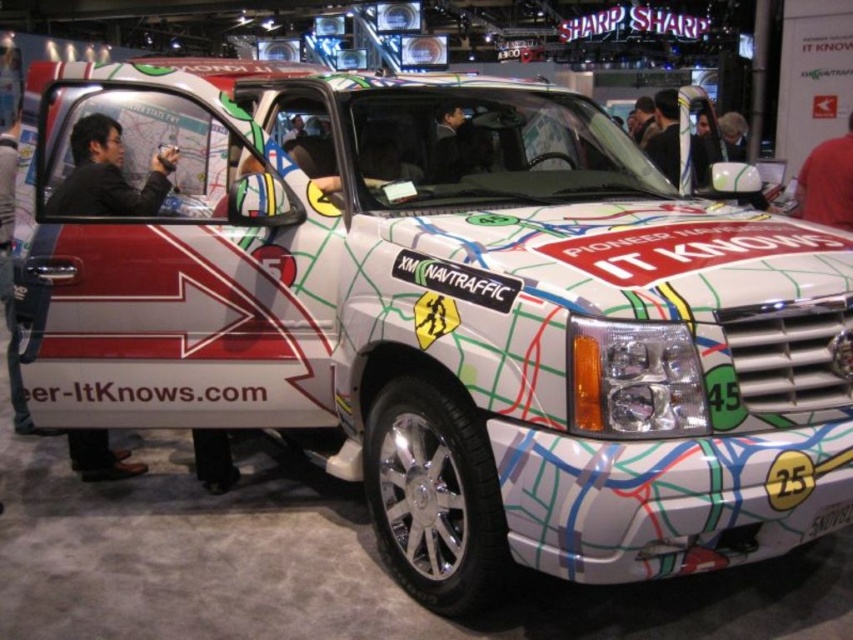
Which is behind, point (108, 209) or point (843, 193)?

Point (843, 193)

This screenshot has height=640, width=853. What do you see at coordinates (107, 173) in the screenshot? I see `matte black jacket at left` at bounding box center [107, 173].

Which is in front, point (126, 464) or point (846, 198)?

Point (126, 464) is in front.

Where is `matte black jacket at left`? matte black jacket at left is located at coordinates (107, 173).

Which of these two, red shirt at upper right or black leather jacket at upper center, stands taller?

Standing taller between the two is black leather jacket at upper center.

Which is above, red shirt at upper right or black leather jacket at upper center?

black leather jacket at upper center

Between point (811, 157) and point (659, 168), which one is positioned behind?

The point (811, 157) is behind.

The image size is (853, 640). I want to click on red shirt at upper right, so click(827, 182).

Is point (96, 186) positioned in front of point (672, 131)?

Yes, it is in front of point (672, 131).

Can you confirm if matte black jacket at left is wider than black leather jacket at upper center?

Yes.

Identify the location of matte black jacket at left. (107, 173).